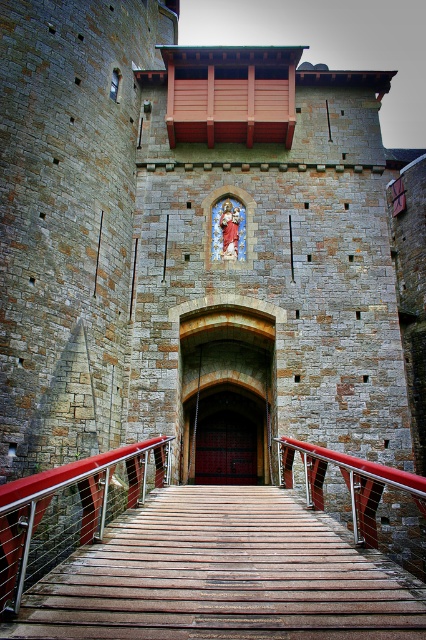
Is dark red wood door at center below glass mosaic at center?

Correct, dark red wood door at center is located below glass mosaic at center.

Does dark red wood door at center have a lesser height compared to glass mosaic at center?

Incorrect, dark red wood door at center's height does not fall short of glass mosaic at center's.

Is point (256, 435) positioned in front of point (212, 225)?

No, it is not.

This screenshot has width=426, height=640. Find the location of `dark red wood door at center`. dark red wood door at center is located at coordinates (226, 449).

Does point (54, 486) come behind point (229, 436)?

No.

Is wooden textured rail at center closer to the viewer compared to dark red wood door at center?

Yes, it is in front of dark red wood door at center.

Does point (86, 499) come farther from viewer compared to point (210, 435)?

No, it is in front of (210, 435).

Image resolution: width=426 pixels, height=640 pixels. Find the location of `wooden textured rail at center`. wooden textured rail at center is located at coordinates pyautogui.click(x=71, y=509).

Is point (137, 634) positioned behind point (244, 444)?

No.

At what (x,y) coordinates should I click in order to perform the action: click on metallic red railing at center. Please return your answer as a coordinate pair (x, y). This screenshot has width=426, height=640. Looking at the image, I should click on (196, 554).